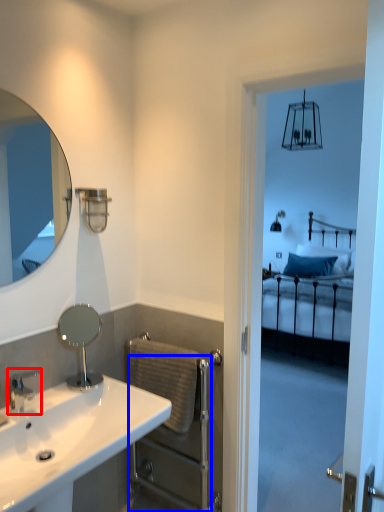
Question: Among these objects, which one is farthest to the camera, tap (highlighted by a red box) or balustrade (highlighted by a blue box)?

Choices:
 (A) tap
 (B) balustrade

Answer: (B)